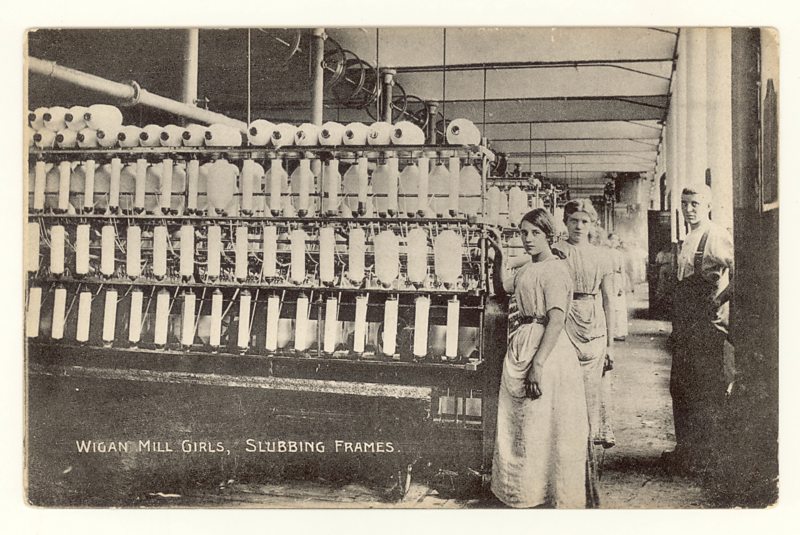
The height and width of the screenshot is (535, 800). I want to click on top of column, so click(x=389, y=78).